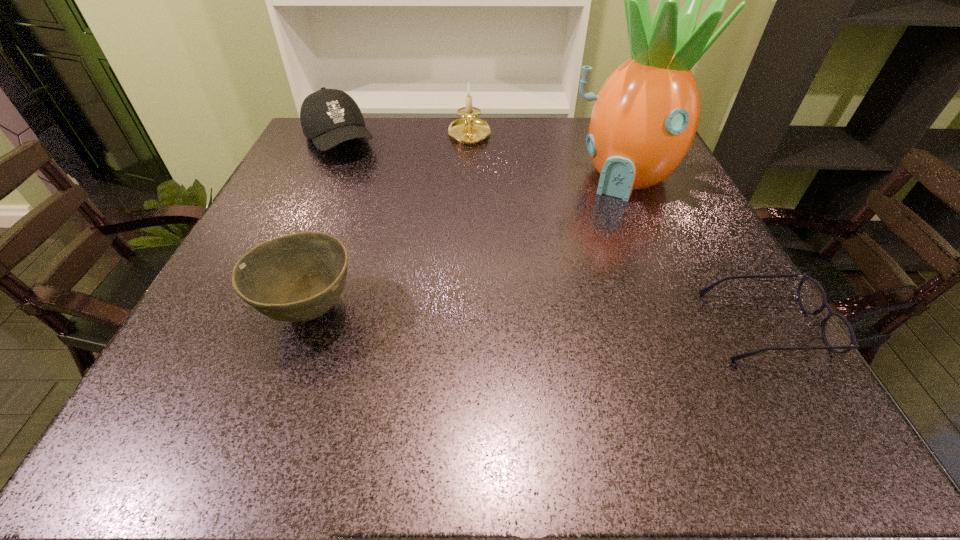
Image resolution: width=960 pixels, height=540 pixels. Find the location of `bowl`. bowl is located at coordinates (297, 277).

In order to click on spectacles in this screenshot , I will do `click(838, 334)`.

Find the location of `the third object from right to left`. the third object from right to left is located at coordinates (469, 130).

Where is `baseball cap`? The height and width of the screenshot is (540, 960). baseball cap is located at coordinates (329, 117).

This screenshot has height=540, width=960. Identify the location of pineapple. (645, 117).

This screenshot has width=960, height=540. Find the location of `vacant space situated on the back of the bowl`. vacant space situated on the back of the bowl is located at coordinates (334, 243).

You are a GUI agent. You are given a task and a screenshot of the screen. Output one action in this format:
    pyautogui.click(x=<x>, y=<y>)
    Task: Click on the free space located 0.060m on the handle side of the third object from right to left
    
    Given the screenshot: What is the action you would take?
    pyautogui.click(x=471, y=164)

Find the location of a particular element. The height and width of the screenshot is (540, 960). blank area located 0.150m on the handle side of the third object from right to left is located at coordinates (473, 185).

The width and height of the screenshot is (960, 540). Find the location of `blank space located on the handle side of the third object from right to left`. blank space located on the handle side of the third object from right to left is located at coordinates (477, 232).

Locate an element on the screen. free spot located on the front-facing side of the baseball cap is located at coordinates (368, 186).